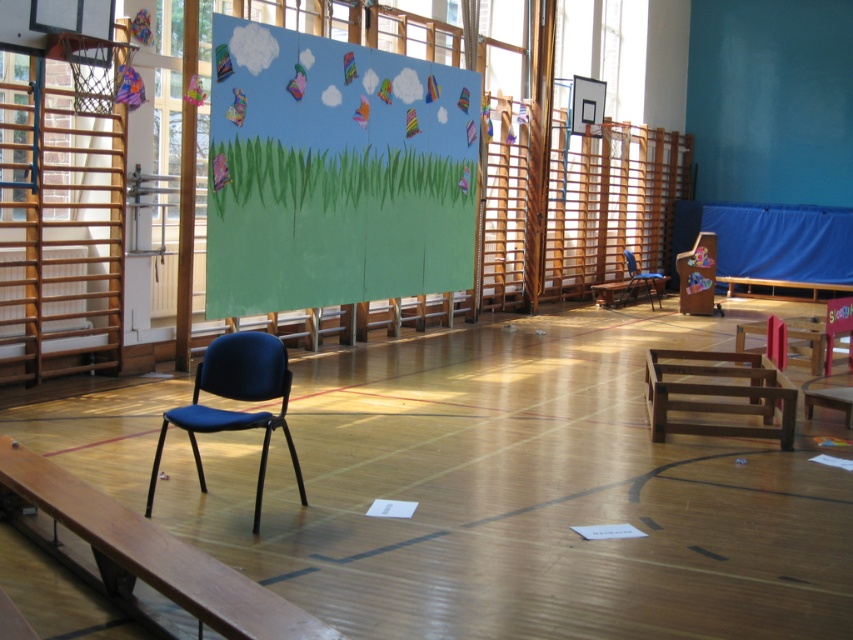
You are a painter who wants to hang a new artwork on the wall behind the pastel paper grass at center and the brown wooden bench at right. Which object is closer to the wall so that the artwork can be placed above it?

A: The brown wooden bench at right is closer to the wall than the pastel paper grass at center, so the artwork should be placed above the brown wooden bench at right.

You are a gym teacher planning to place a new equipment in the gym. You have a large storage box that needs to be placed either on the pastel paper grass at center or the brown wooden bench at center. Based on their positions, which surface can support the box better?

The brown wooden bench at center is a better choice because the pastel paper grass at center is positioned above it, meaning the bench is lower and more stable for placing heavy items.

You are standing at the entrance of the gymnasium and want to move towards the two points marked on the wall. Which point, point [370,147] or point [844,291], is closer to you?

Point [370,147] is closer to you than point [844,291] because it is closer to the camera.